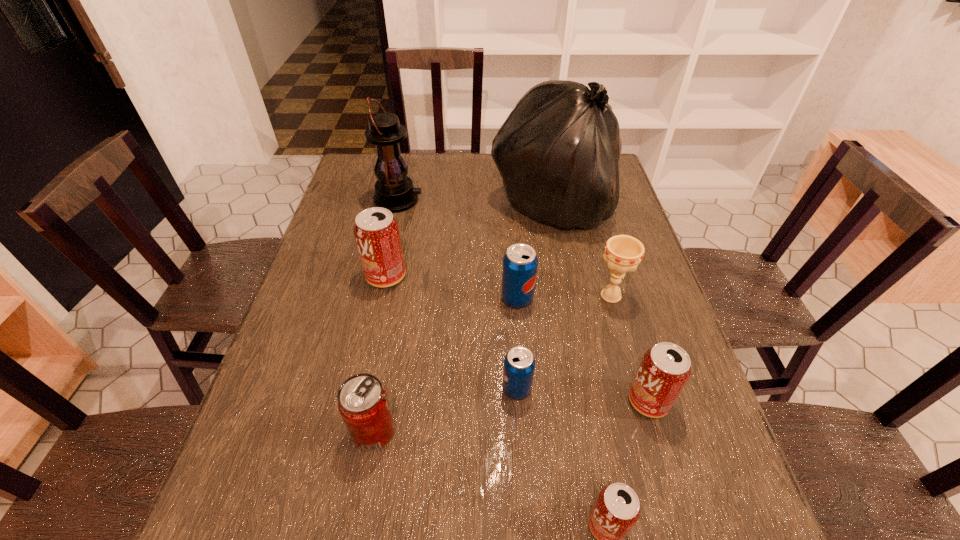
Pinpoint the vacant space located 0.340m above the lantern, indicating its light source. Please provide its 2D coordinates. Your answer should be formatted as a tuple, i.e. [(x, y)], where the tuple contains the x and y coordinates of a point satisfying the conditions above.

[(527, 200)]

Locate an element on the screen. The height and width of the screenshot is (540, 960). vacant space positioned 0.050m on the left of the tallest soda can is located at coordinates (348, 276).

Where is `free space located on the back of the chalice`? The image size is (960, 540). free space located on the back of the chalice is located at coordinates (603, 267).

The width and height of the screenshot is (960, 540). In order to click on vacant space located 0.070m on the right of the farther blue pop soda in this screenshot , I will do `click(561, 298)`.

Identify the location of vacant space located 0.380m on the back of the rightmost red soda can. The width and height of the screenshot is (960, 540). coord(608,263).

Where is `vacant region located 0.090m on the front of the smaller blue pop soda`? The width and height of the screenshot is (960, 540). vacant region located 0.090m on the front of the smaller blue pop soda is located at coordinates (520, 444).

Where is `plastic bag positioned at the far edge`? The image size is (960, 540). plastic bag positioned at the far edge is located at coordinates (558, 152).

Identify the location of lantern that is at the far edge. This screenshot has width=960, height=540. (394, 190).

Identify the location of lantern that is at the left edge. (394, 190).

I want to click on soda can located at the left edge, so click(x=376, y=231).